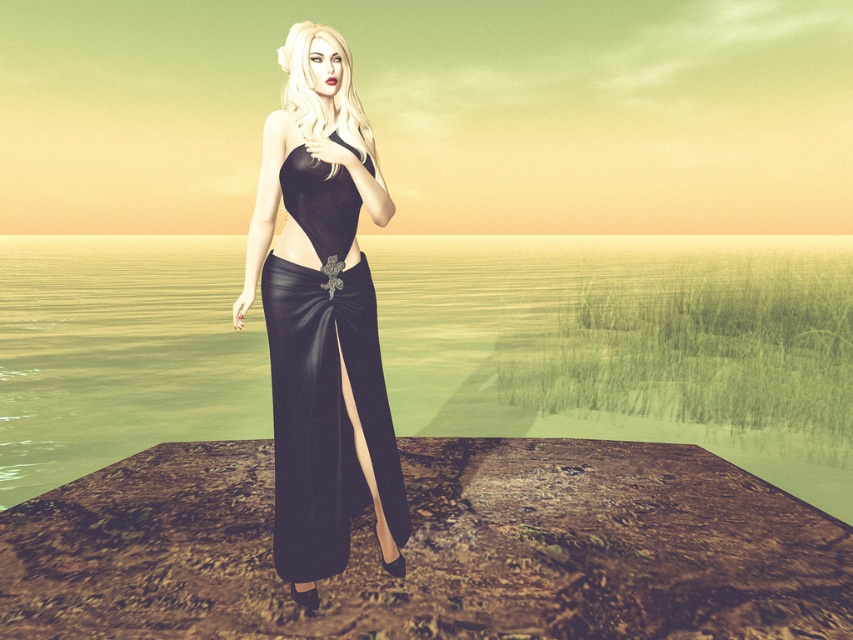
Between glossy water at center and satin black dress at center, which one appears on the left side from the viewer's perspective?

satin black dress at center

In the scene shown: Is glossy water at center bigger than satin black dress at center?

Indeed, glossy water at center has a larger size compared to satin black dress at center.

Is point (379, 243) farther from viewer compared to point (341, 353)?

Yes, it is.

Locate an element on the screen. Image resolution: width=853 pixels, height=640 pixels. glossy water at center is located at coordinates (622, 344).